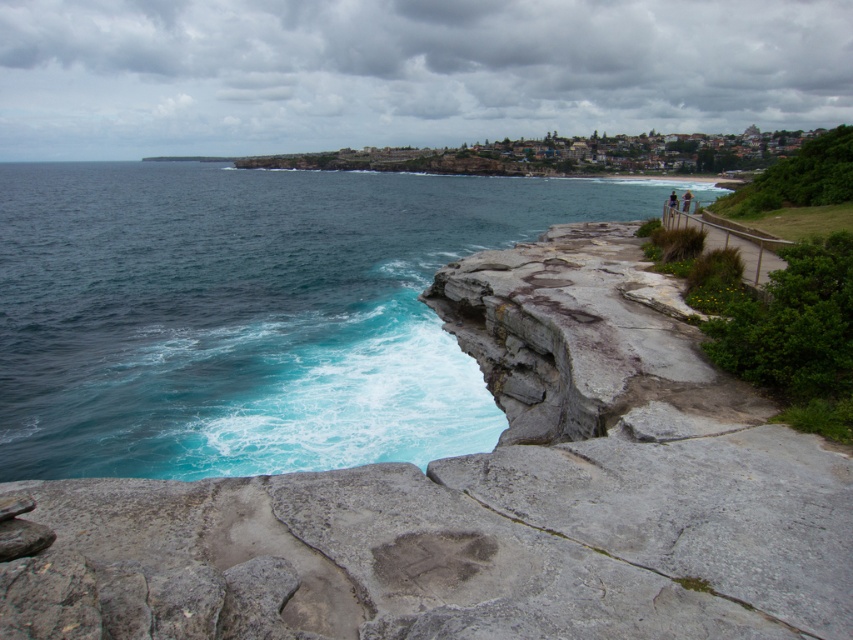
You are a hiker who wants to place a dark blue fabric at upper right on top of the gray rock at center. Based on their sizes, will the fabric cover the entire rock?

The gray rock at center has a smaller size compared to dark blue fabric at upper right, so the fabric will cover the entire rock.

You are a photographer standing at the cliff edge. You want to capture a photo that includes both the point at coordinates point (202,371) and point (675,209). Which point is closer to your camera lens?

Point (202,371) is closer to the camera than point (675,209), so it will appear nearer in the photo.